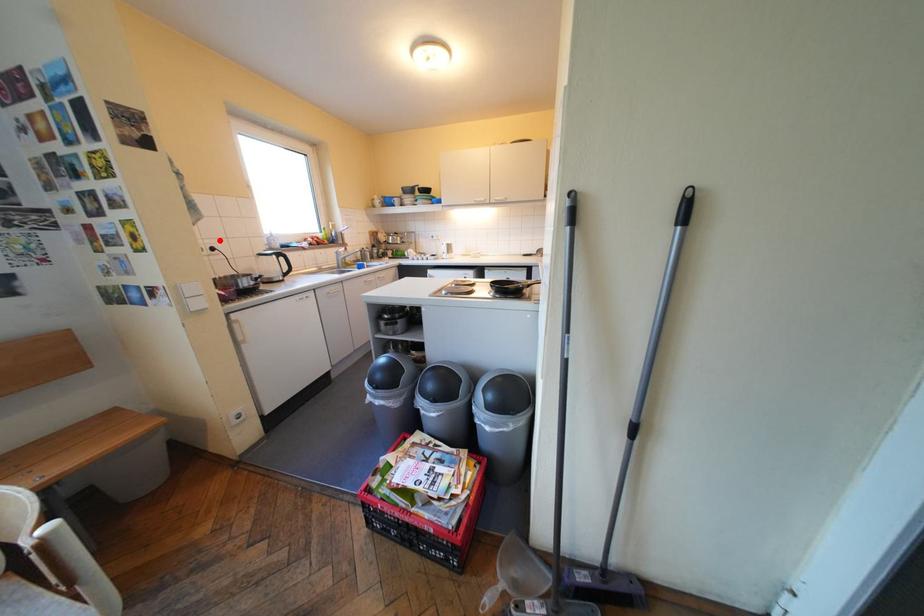
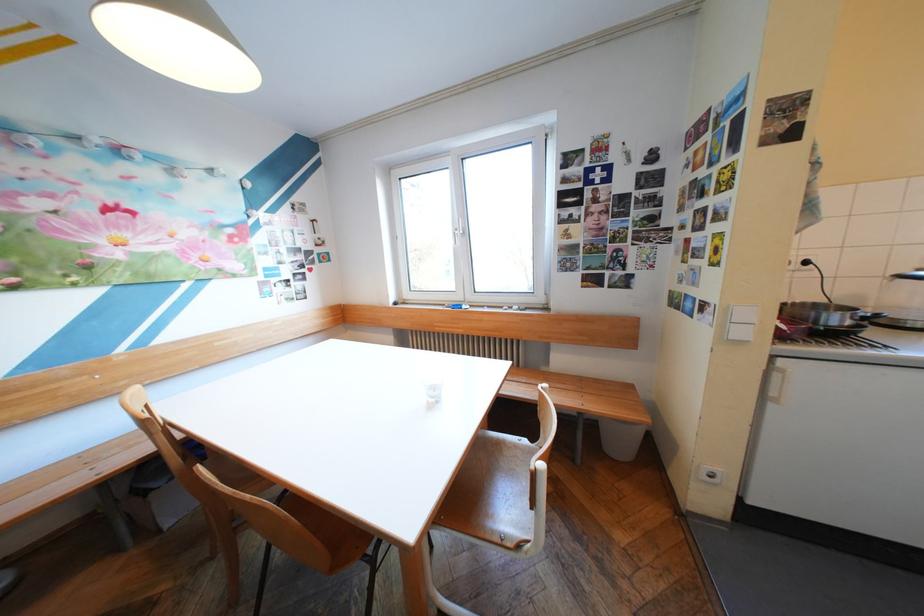
Locate, in the second image, the point that corresponds to the highlighted location in the first image.

(816, 252)